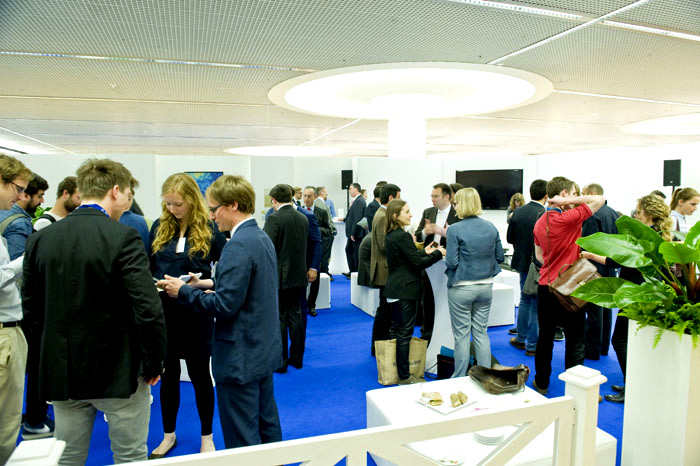
This screenshot has height=466, width=700. Find the location of `plant`. plant is located at coordinates (658, 280).